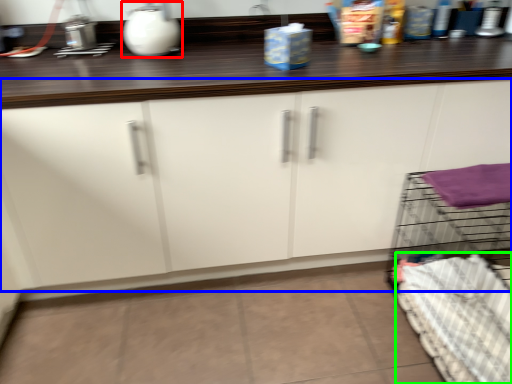
Question: Which object is the farthest from appliance (highlighted by a red box)? Choose among these: cabinetry (highlighted by a blue box) or bedding (highlighted by a green box).

Choices:
 (A) cabinetry
 (B) bedding

Answer: (B)